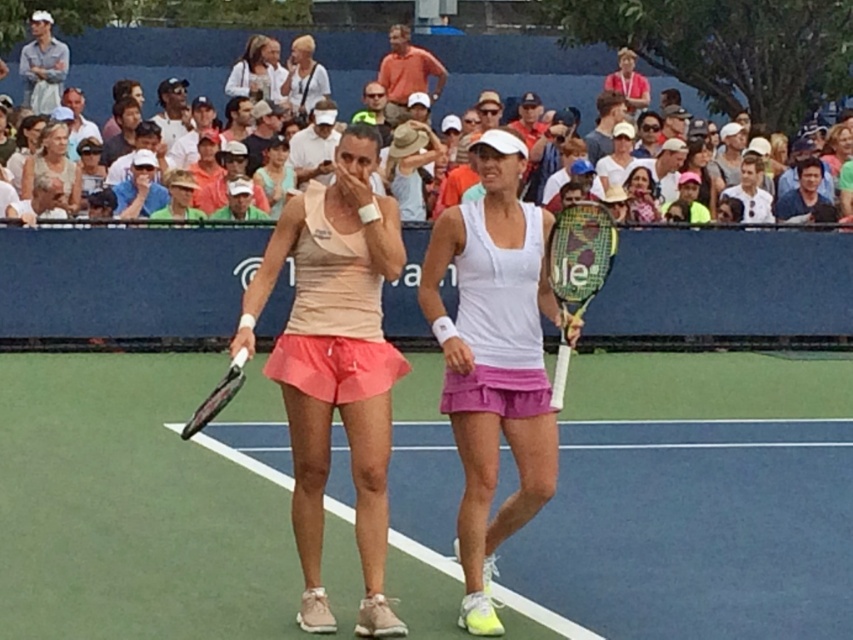
Which is below, white textured racket at center or matte white tank top at center?

white textured racket at center is lower down.

How distant is white textured racket at center from matte white tank top at center?

white textured racket at center is 15.12 meters from matte white tank top at center.

What do you see at coordinates (577, 269) in the screenshot?
I see `white textured racket at center` at bounding box center [577, 269].

In order to click on white textured racket at center in this screenshot , I will do `click(577, 269)`.

Between white matte tennis skirt at center and white textured racket at center, which one has less height?

white textured racket at center is shorter.

Can you confirm if white matte tennis skirt at center is taller than white textured racket at center?

Yes, white matte tennis skirt at center is taller than white textured racket at center.

Describe the element at coordinates (494, 358) in the screenshot. I see `white matte tennis skirt at center` at that location.

Locate an element on the screen. The image size is (853, 640). white matte tennis skirt at center is located at coordinates (494, 358).

Between matte peach tank top at center and light blue fabric at center, which one appears on the right side from the viewer's perspective?

Positioned to the right is matte peach tank top at center.

Between point (328, 406) and point (274, 193), which one is positioned in front?

Point (328, 406) is in front.

Find the location of a particular element. matte peach tank top at center is located at coordinates (335, 364).